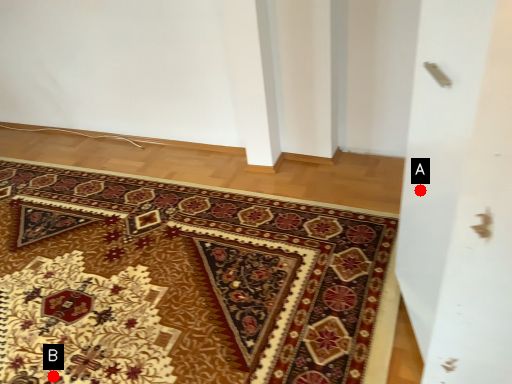
Question: Two points are circled on the image, labeled by A and B beside each circle. Which point appears farthest from the camera in this image?

Choices:
 (A) A is further
 (B) B is further

Answer: (B)